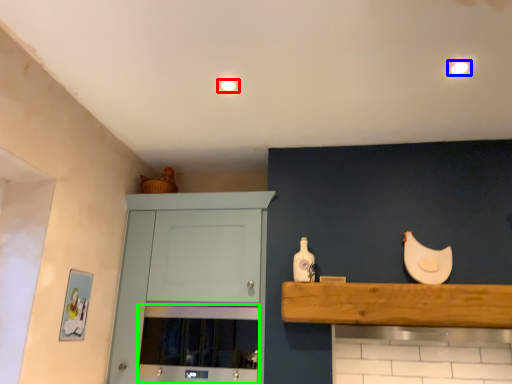
Question: Based on their relative distances, which object is farther from lighting (highlighted by a red box)? Choose from lighting (highlighted by a blue box) and oven (highlighted by a green box).

Choices:
 (A) lighting
 (B) oven

Answer: (B)